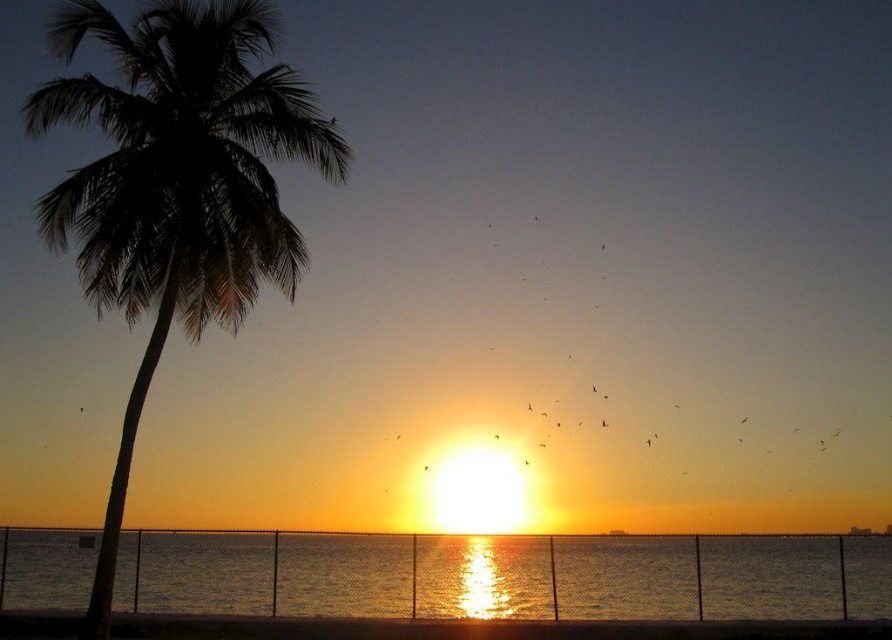
Question: Where is silhouette leafy palm at left located in relation to shiny metallic water at center in the image?

Choices:
 (A) right
 (B) left

Answer: (B)

Question: Which point appears closest to the camera in this image?

Choices:
 (A) (359, 636)
 (B) (395, 538)

Answer: (A)

Question: Considering the relative positions of silhouette leafy palm at left and shiny metallic water at center in the image provided, where is silhouette leafy palm at left located with respect to shiny metallic water at center?

Choices:
 (A) below
 (B) above

Answer: (B)

Question: Among these points, which one is nearest to the camera?

Choices:
 (A) (201, 3)
 (B) (143, 630)

Answer: (A)

Question: In this image, where is silhouette leafy palm at left located relative to smooth sand at lower center?

Choices:
 (A) right
 (B) left

Answer: (B)

Question: Which object is positioned closest to the smooth sand at lower center?

Choices:
 (A) silhouette leafy palm at left
 (B) shiny metallic water at center

Answer: (B)